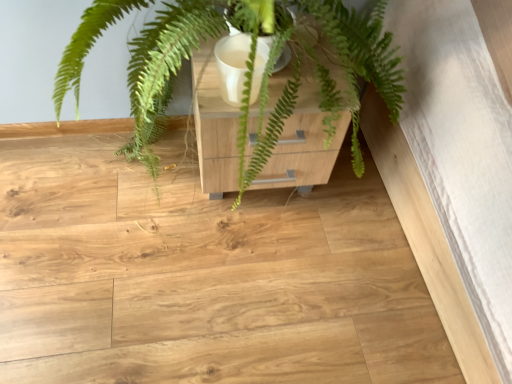
Identify the location of vacant area that is in front of wooden dresser at center. (245, 263).